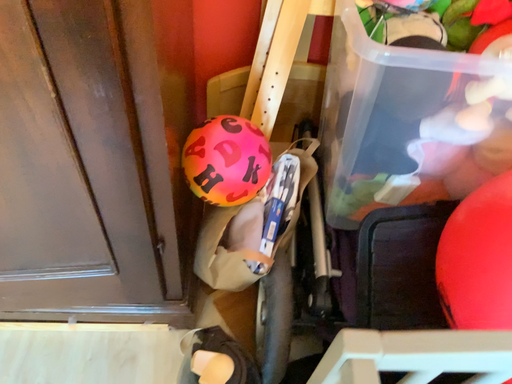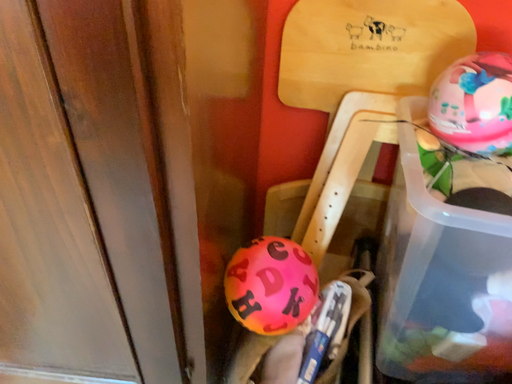
Question: Which way did the camera rotate in the video?

Choices:
 (A) rotated downward
 (B) rotated upward

Answer: (B)